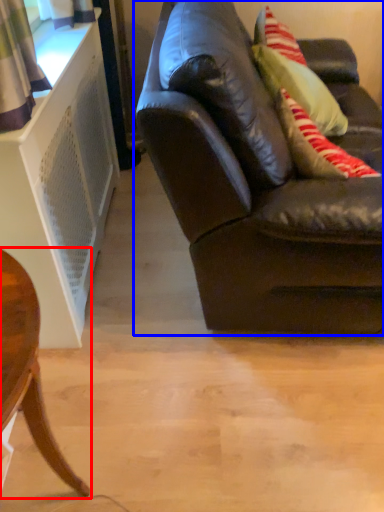
Question: Which of the following is the closest to the observer, chair (highlighted by a red box) or studio couch (highlighted by a blue box)?

Choices:
 (A) chair
 (B) studio couch

Answer: (A)